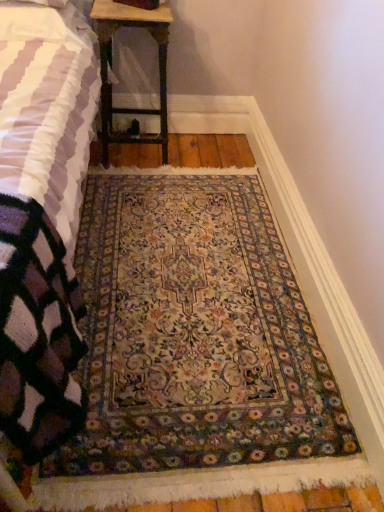
Question: From a real-world perspective, is knitted wool blanket at lower left below wooden table at upper center?

Choices:
 (A) no
 (B) yes

Answer: (A)

Question: Is wooden table at upper center located within knitted wool blanket at lower left?

Choices:
 (A) yes
 (B) no

Answer: (A)

Question: From the image's perspective, would you say knitted wool blanket at lower left is positioned over wooden table at upper center?

Choices:
 (A) no
 (B) yes

Answer: (A)

Question: Is knitted wool blanket at lower left facing away from wooden table at upper center?

Choices:
 (A) no
 (B) yes

Answer: (A)

Question: Does knitted wool blanket at lower left have a greater height compared to wooden table at upper center?

Choices:
 (A) no
 (B) yes

Answer: (B)

Question: From the image's perspective, would you say knitted wool blanket at lower left is shown under wooden table at upper center?

Choices:
 (A) no
 (B) yes

Answer: (B)

Question: From the image's perspective, is knitted wool blanket at lower left above carpeted rug at center?

Choices:
 (A) yes
 (B) no

Answer: (A)

Question: From a real-world perspective, is knitted wool blanket at lower left on top of carpeted rug at center?

Choices:
 (A) yes
 (B) no

Answer: (A)

Question: Is knitted wool blanket at lower left next to carpeted rug at center and touching it?

Choices:
 (A) no
 (B) yes

Answer: (A)

Question: Is knitted wool blanket at lower left wider than carpeted rug at center?

Choices:
 (A) no
 (B) yes

Answer: (B)

Question: Is knitted wool blanket at lower left further to camera compared to carpeted rug at center?

Choices:
 (A) no
 (B) yes

Answer: (A)

Question: Does knitted wool blanket at lower left have a lesser height compared to carpeted rug at center?

Choices:
 (A) yes
 (B) no

Answer: (B)

Question: From the image's perspective, is carpeted rug at center located beneath wooden table at upper center?

Choices:
 (A) yes
 (B) no

Answer: (A)